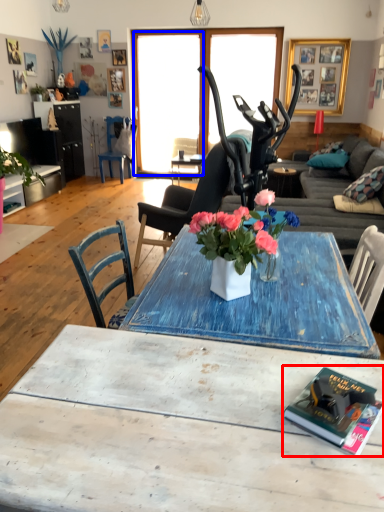
Question: Which object appears farthest to the camera in this image, book (highlighted by a red box) or window screen (highlighted by a blue box)?

Choices:
 (A) book
 (B) window screen

Answer: (B)